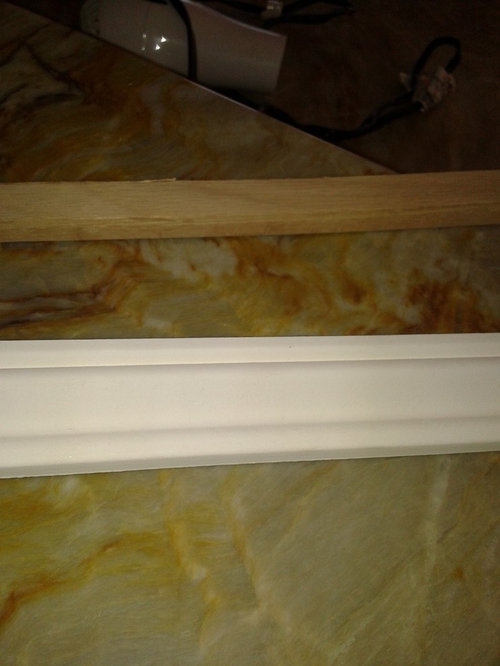
Find the location of `marbled pattern benchtop`. marbled pattern benchtop is located at coordinates tap(298, 515).